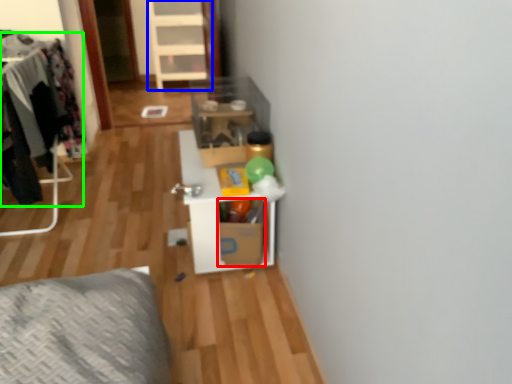
Question: Which is nearer to the cardboard box (highlighted by a red box)? dresser (highlighted by a blue box) or clothing (highlighted by a green box).

Choices:
 (A) dresser
 (B) clothing

Answer: (B)